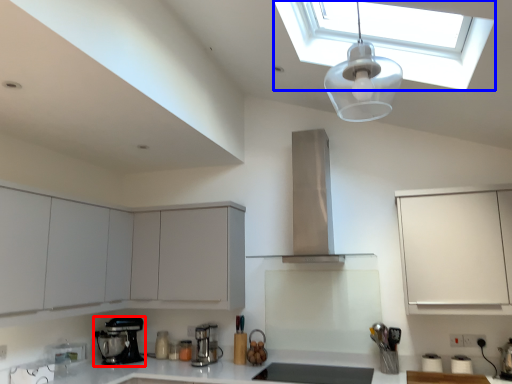
Question: Which point is closer to the camera, kitchen appliance (highlighted by a red box) or window (highlighted by a blue box)?

Choices:
 (A) kitchen appliance
 (B) window

Answer: (B)